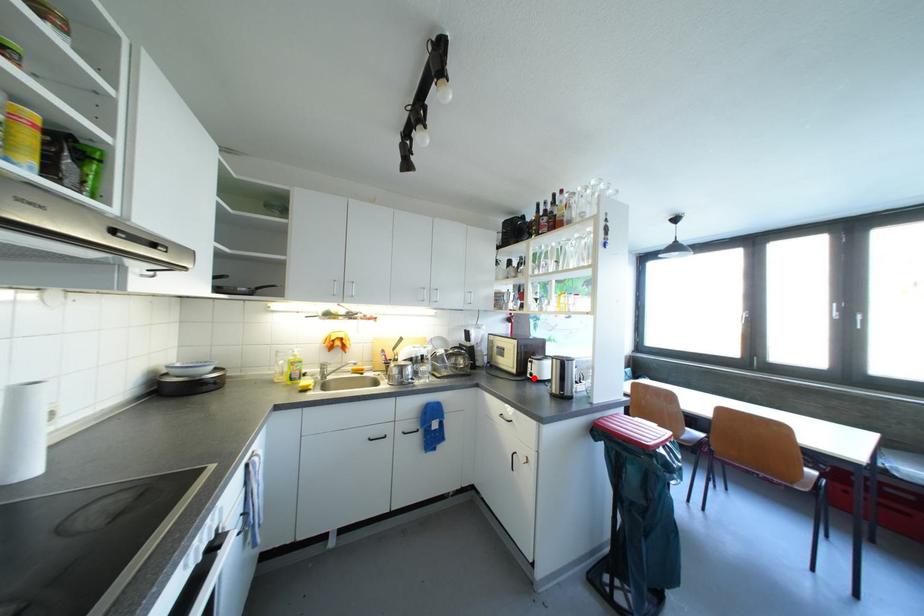
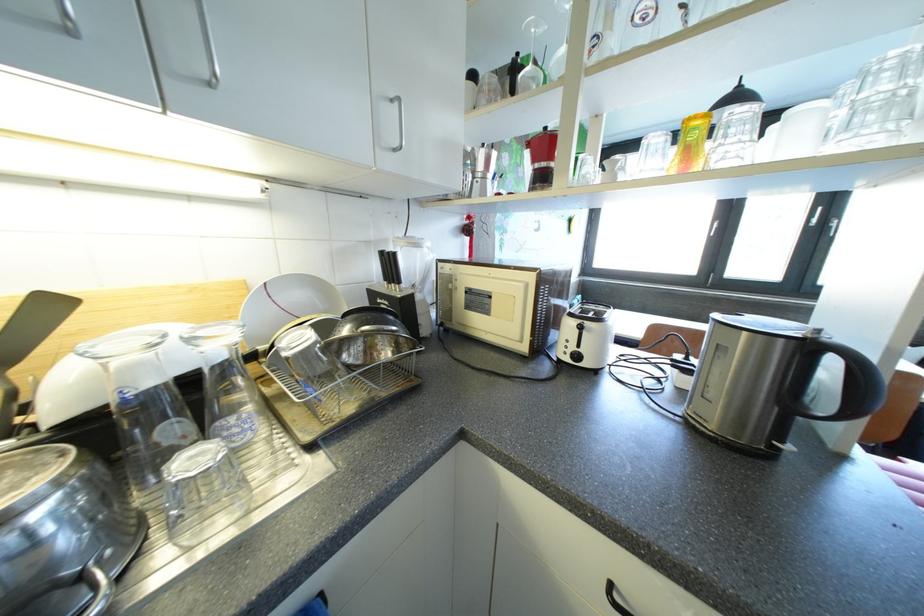
Question: I am providing you with two images of the same scene from different viewpoints. In image1, a red point is highlighted. Considering the same 3D point in image2, which of the following is correct?

Choices:
 (A) It is closer
 (B) It is farther

Answer: (A)